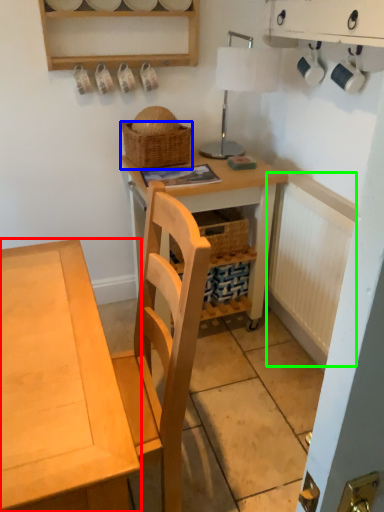
Question: Which object is positioned closest to desk (highlighted by a red box)? Select from picnic basket (highlighted by a blue box) and radiator (highlighted by a green box).

Choices:
 (A) picnic basket
 (B) radiator

Answer: (A)